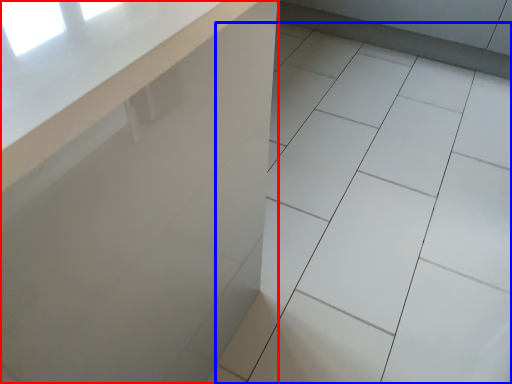
Question: Which object is further to the camera taking this photo, counter (highlighted by a red box) or ceramic tile (highlighted by a blue box)?

Choices:
 (A) counter
 (B) ceramic tile

Answer: (B)